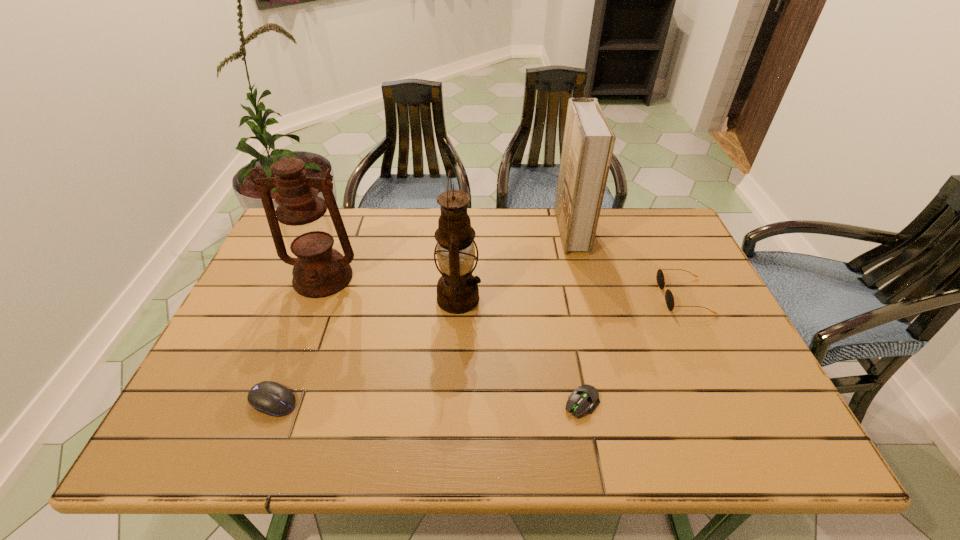
At what (x,y) coordinates should I click in order to perform the action: click on the farthest object. Please return your answer as a coordinate pair (x, y). Looking at the image, I should click on (588, 143).

Locate an element on the screen. the fourth object from right to left is located at coordinates (457, 289).

At what (x,y) coordinates should I click in order to perform the action: click on the left oil lamp. Please return your answer as a coordinate pair (x, y). Looking at the image, I should click on (319, 271).

Find the location of a particular element. the fourth tallest object is located at coordinates (669, 297).

Find the location of `the rightmost object`. the rightmost object is located at coordinates (669, 297).

Image resolution: width=960 pixels, height=540 pixels. Identify the location of the left computer mouse. (271, 398).

Locate an element on the screen. the second shortest object is located at coordinates (271, 398).

Locate an element on the screen. The image size is (960, 540). the shortest object is located at coordinates (584, 398).

Identify the location of the shorter computer mouse. The width and height of the screenshot is (960, 540). (584, 398).

Identify the location of free location located on the cover of the phonebook. This screenshot has height=540, width=960. (477, 230).